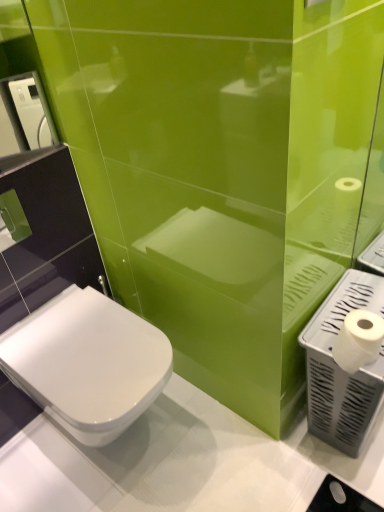
Question: In terms of width, does white matte toilet paper at right look wider or thinner when compared to white plastic hand dryer at right, the second hand dryer in the left-to-right sequence?

Choices:
 (A) wide
 (B) thin

Answer: (B)

Question: Looking at the image, does white matte toilet paper at right seem bigger or smaller compared to white plastic hand dryer at right, the second hand dryer in the left-to-right sequence?

Choices:
 (A) small
 (B) big

Answer: (A)

Question: Based on their relative distances, which object is farther from the white glossy toilet at lower left?

Choices:
 (A) white plastic hand dryer at upper left, positioned as the second hand dryer in bottom-to-top order
 (B) white plastic hand dryer at right, the first hand dryer in the bottom-to-top sequence
 (C) white matte toilet paper at right

Answer: (A)

Question: Estimate the real-world distances between objects in this image. Which object is farther from the white plastic hand dryer at right, the first hand dryer in the bottom-to-top sequence?

Choices:
 (A) white glossy toilet at lower left
 (B) white matte toilet paper at right
 (C) white plastic hand dryer at upper left, which ranks as the first hand dryer in top-to-bottom order

Answer: (C)